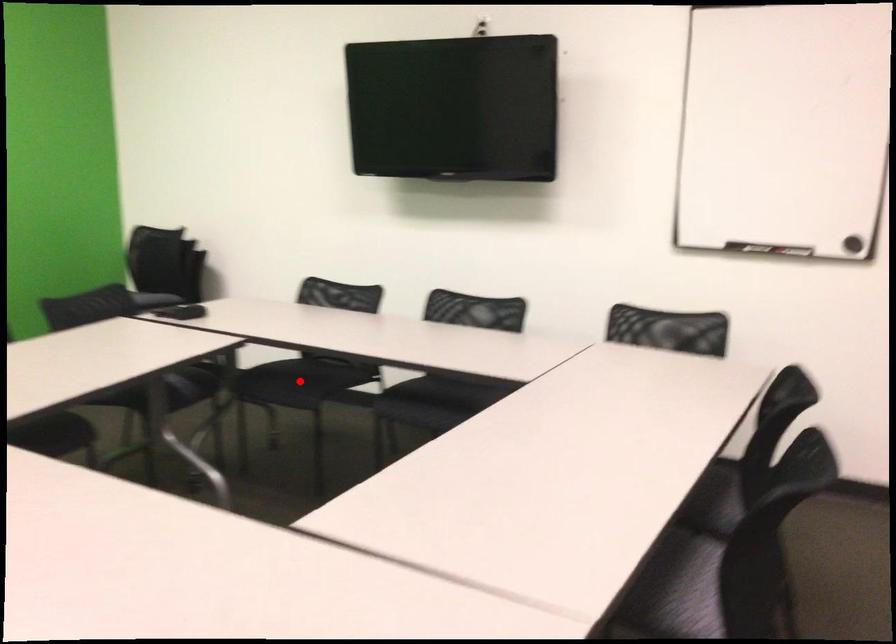
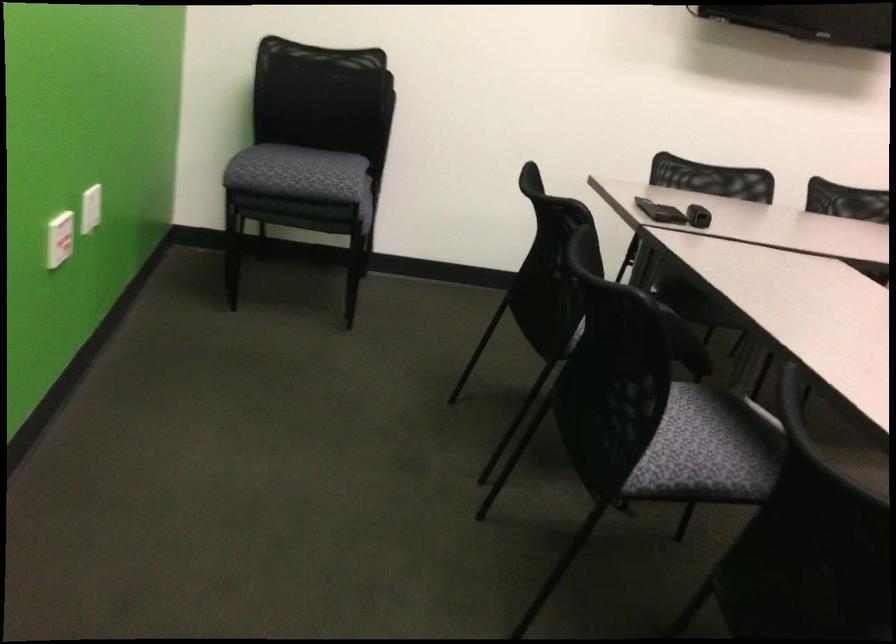
Question: I am providing you with two images of the same scene from different viewpoints. A red point is marked on the first image. At the location where the point appears in image 1, is it still visible in image 2?

Choices:
 (A) Yes
 (B) No

Answer: (B)